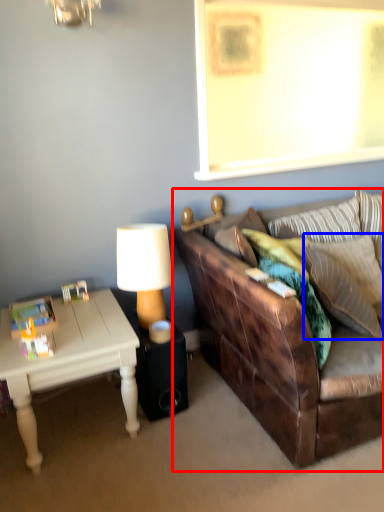
Question: Which object is further to the camera taking this photo, studio couch (highlighted by a red box) or pillow (highlighted by a blue box)?

Choices:
 (A) studio couch
 (B) pillow

Answer: (B)